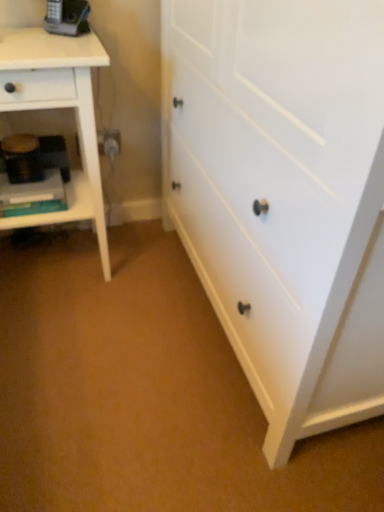
Question: In the image, is matte black phone at upper left on the left side or the right side of white wood nightstand at left?

Choices:
 (A) left
 (B) right

Answer: (B)

Question: Is matte black phone at upper left wider or thinner than white wood nightstand at left?

Choices:
 (A) wide
 (B) thin

Answer: (B)

Question: Considering the real-world distances, which object is farthest from the white matte chest of drawers at center?

Choices:
 (A) white wood nightstand at left
 (B) matte black phone at upper left

Answer: (B)

Question: Considering the real-world distances, which object is farthest from the white wood nightstand at left?

Choices:
 (A) white matte chest of drawers at center
 (B) matte black phone at upper left

Answer: (A)